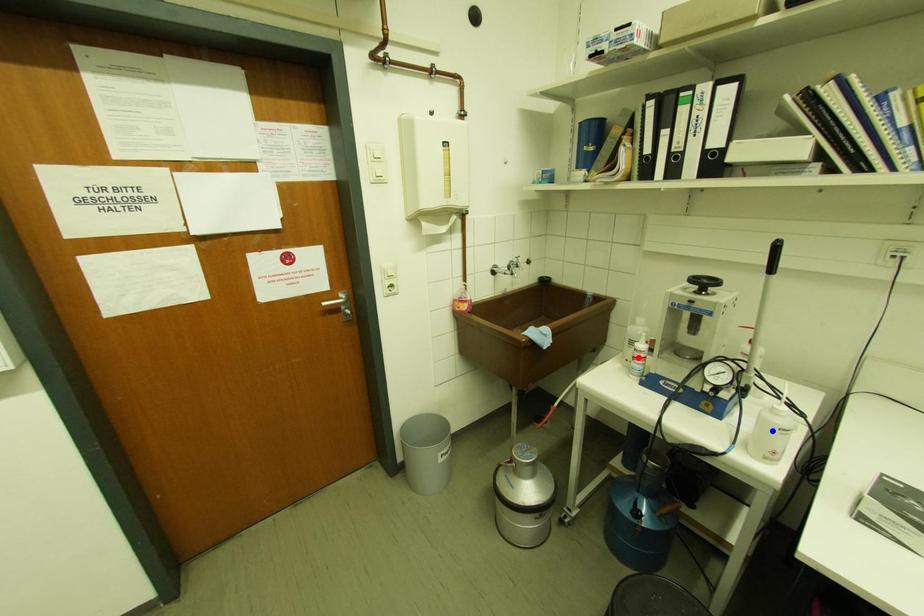
Question: Which of the two points in the image is closer to the camera?

Choices:
 (A) Blue point is closer.
 (B) Red point is closer.

Answer: (A)